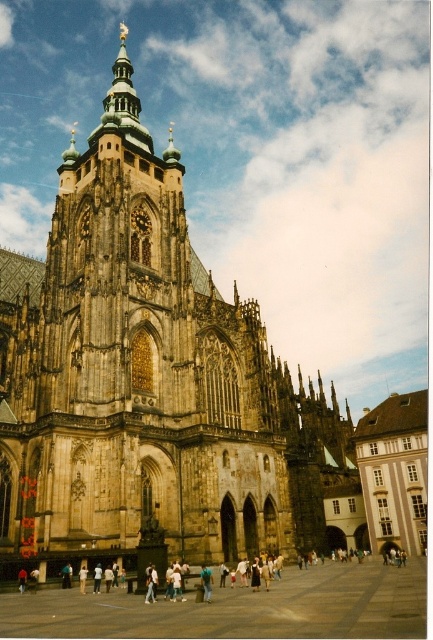
You are standing in front of the cathedral and see both the brown stone church at center and the light blue jeans at center. Which object is closer to you?

The brown stone church at center is closer to you since the light blue jeans at center is behind it.

You are standing in front of the cathedral and see the brown stone church at center and the light blue jeans at center. Which object is positioned to the right side?

The brown stone church at center is positioned to the right of the light blue jeans at center.

Based on the coordinates provided, where is the brown stone church at center located in the image?

The brown stone church at center is located at point (148,380).